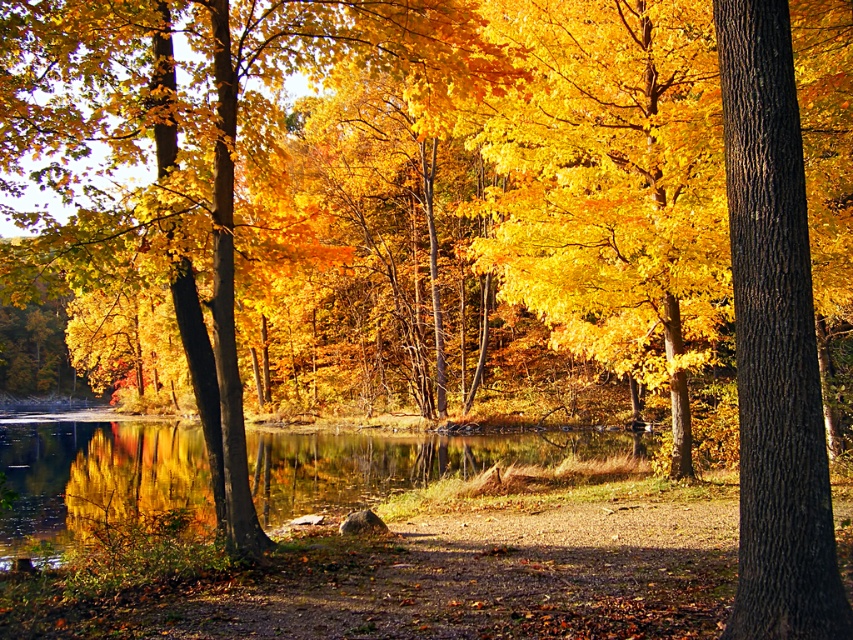
You are standing on the dirt path and want to compare the widths of the brown rough bark tree at right and the glossy reflective water at center. Which object is narrower?

The brown rough bark tree at right is narrower than the glossy reflective water at center.

You are standing on the dirt path and want to take a photo of the brown rough bark tree at right and the glossy reflective water at center. Which object is closer to you?

The brown rough bark tree at right is closer to you because it is positioned over the glossy reflective water at center, meaning it is in front of the water.